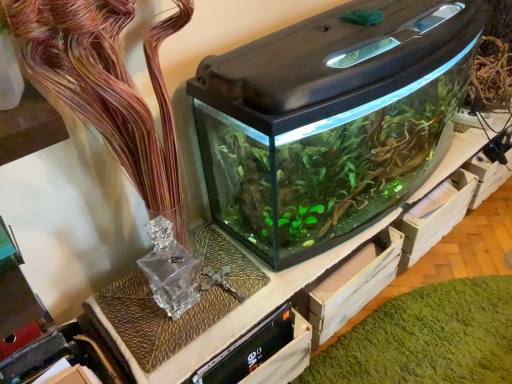
Where is `vacant space underneath green matte algae at center (from a real-world perspective)`? vacant space underneath green matte algae at center (from a real-world perspective) is located at coordinates (443, 303).